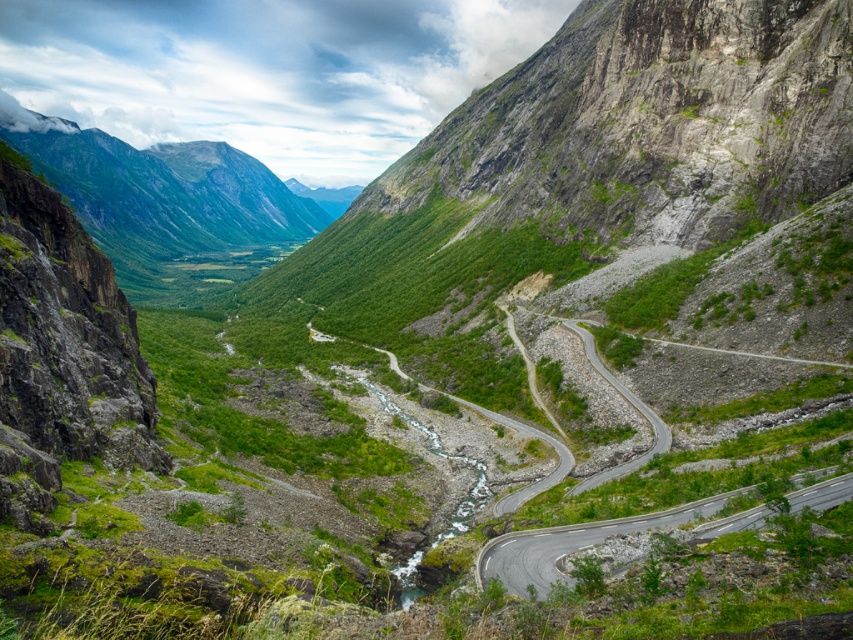
Based on the photo, does green grassy mountain at upper left have a greater width compared to gray asphalt road at lower right?

Yes.

Is point (93, 189) behind point (741, 486)?

Yes, point (93, 189) is farther from viewer.

Between point (100, 212) and point (538, 593), which one is positioned behind?

Point (100, 212)

The width and height of the screenshot is (853, 640). In order to click on green grassy mountain at upper left in this screenshot , I will do `click(165, 192)`.